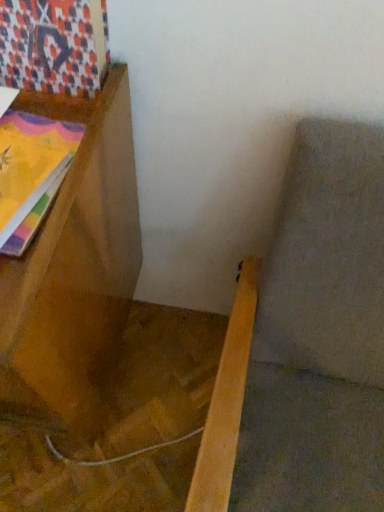
Question: Is point (x=104, y=377) positioned closer to the camera than point (x=102, y=54)?

Choices:
 (A) farther
 (B) closer

Answer: (A)

Question: Which is correct: wooden bookshelf at left is inside patterned fabric at upper left, or outside of it?

Choices:
 (A) inside
 (B) outside

Answer: (B)

Question: From the image's perspective, is wooden bookshelf at left positioned above or below patterned fabric at upper left?

Choices:
 (A) above
 (B) below

Answer: (B)

Question: Looking at the image, does patterned fabric at upper left seem bigger or smaller compared to wooden bookshelf at left?

Choices:
 (A) small
 (B) big

Answer: (A)

Question: Is patterned fabric at upper left situated inside wooden bookshelf at left or outside?

Choices:
 (A) outside
 (B) inside

Answer: (A)

Question: From a real-world perspective, is patterned fabric at upper left positioned above or below wooden bookshelf at left?

Choices:
 (A) above
 (B) below

Answer: (A)

Question: From the image's perspective, is patterned fabric at upper left located above or below wooden bookshelf at left?

Choices:
 (A) above
 (B) below

Answer: (A)